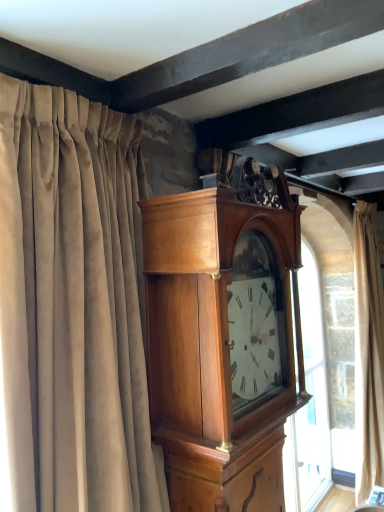
Question: Does suede curtain at left, which ranks as the 1th curtain in left-to-right order, appear on the right side of beige velvet curtain at right, the first curtain positioned from the back?

Choices:
 (A) no
 (B) yes

Answer: (A)

Question: From a real-world perspective, is suede curtain at left, which ranks as the 1th curtain in left-to-right order, physically above beige velvet curtain at right, which ranks as the 2th curtain in front-to-back order?

Choices:
 (A) yes
 (B) no

Answer: (A)

Question: Is beige velvet curtain at right, arranged as the 2th curtain when viewed from the left, located within suede curtain at left, which ranks as the second curtain in right-to-left order?

Choices:
 (A) no
 (B) yes

Answer: (A)

Question: Does suede curtain at left, which ranks as the second curtain in right-to-left order, have a larger size compared to beige velvet curtain at right, placed as the 1th curtain when sorted from right to left?

Choices:
 (A) yes
 (B) no

Answer: (B)

Question: Considering the relative sizes of suede curtain at left, which ranks as the 1th curtain in left-to-right order, and beige velvet curtain at right, which ranks as the 2th curtain in front-to-back order, in the image provided, is suede curtain at left, which ranks as the 1th curtain in left-to-right order, taller than beige velvet curtain at right, which ranks as the 2th curtain in front-to-back order,?

Choices:
 (A) no
 (B) yes

Answer: (A)

Question: Is suede curtain at left, which ranks as the 1th curtain in left-to-right order, not near beige velvet curtain at right, placed as the 1th curtain when sorted from right to left?

Choices:
 (A) yes
 (B) no

Answer: (A)

Question: Can you confirm if beige velvet curtain at right, placed as the 1th curtain when sorted from right to left, is smaller than suede curtain at left, the second curtain viewed from the back?

Choices:
 (A) no
 (B) yes

Answer: (A)

Question: Would you say beige velvet curtain at right, arranged as the 2th curtain when viewed from the left, contains suede curtain at left, the second curtain viewed from the back?

Choices:
 (A) no
 (B) yes

Answer: (A)

Question: From a real-world perspective, is beige velvet curtain at right, arranged as the 2th curtain when viewed from the left, under suede curtain at left, which ranks as the 1th curtain in left-to-right order?

Choices:
 (A) no
 (B) yes

Answer: (B)

Question: Is beige velvet curtain at right, which ranks as the 2th curtain in front-to-back order, further to the viewer compared to suede curtain at left, which ranks as the 1th curtain in left-to-right order?

Choices:
 (A) yes
 (B) no

Answer: (A)

Question: Is beige velvet curtain at right, which ranks as the 2th curtain in front-to-back order, to the right of suede curtain at left, the second curtain viewed from the back, from the viewer's perspective?

Choices:
 (A) no
 (B) yes

Answer: (B)

Question: From a real-world perspective, is beige velvet curtain at right, the first curtain positioned from the back, physically above suede curtain at left, which ranks as the second curtain in right-to-left order?

Choices:
 (A) no
 (B) yes

Answer: (A)

Question: Can you confirm if polished wood wall clock at center is shorter than beige velvet curtain at right, arranged as the 2th curtain when viewed from the left?

Choices:
 (A) yes
 (B) no

Answer: (A)